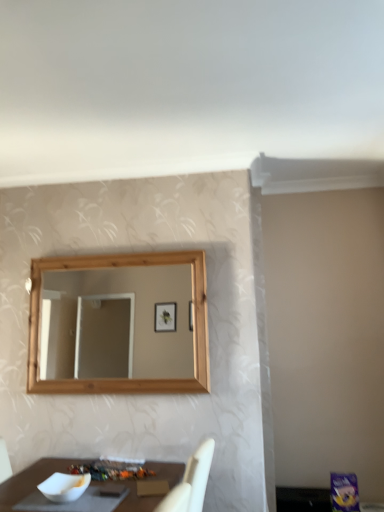
Identify the location of white glossy bowl at lower left. This screenshot has width=384, height=512. (111, 470).

This screenshot has width=384, height=512. What do you see at coordinates (111, 470) in the screenshot?
I see `white glossy bowl at lower left` at bounding box center [111, 470].

This screenshot has height=512, width=384. Identify the location of white matte bowl at lower left. (64, 486).

The height and width of the screenshot is (512, 384). Describe the element at coordinates (64, 486) in the screenshot. I see `white matte bowl at lower left` at that location.

I want to click on white glossy bowl at lower left, so click(111, 470).

Does white matte bowl at lower left appear on the right side of white glossy bowl at lower left?

No, white matte bowl at lower left is not to the right of white glossy bowl at lower left.

Considering the positions of objects white matte bowl at lower left and white glossy bowl at lower left in the image provided, who is behind, white matte bowl at lower left or white glossy bowl at lower left?

Positioned behind is white glossy bowl at lower left.

Between point (86, 488) and point (139, 472), which one is positioned in front?

The point (86, 488) is closer to the camera.

From the image's perspective, is white matte bowl at lower left located above or below white glossy bowl at lower left?

Clearly, from the image's perspective, white matte bowl at lower left is above white glossy bowl at lower left.

From a real-world perspective, which is physically above, white matte bowl at lower left or white glossy bowl at lower left?

white matte bowl at lower left is physically above.

Considering the sizes of objects white matte bowl at lower left and white glossy bowl at lower left in the image provided, who is wider, white matte bowl at lower left or white glossy bowl at lower left?

With larger width is white glossy bowl at lower left.

Can you confirm if white matte bowl at lower left is taller than white glossy bowl at lower left?

Yes, white matte bowl at lower left is taller than white glossy bowl at lower left.

Considering the relative sizes of white matte bowl at lower left and white glossy bowl at lower left in the image provided, is white matte bowl at lower left bigger than white glossy bowl at lower left?

Indeed, white matte bowl at lower left has a larger size compared to white glossy bowl at lower left.

Is white matte bowl at lower left outside of white glossy bowl at lower left?

Yes, white matte bowl at lower left is outside of white glossy bowl at lower left.

Is white matte bowl at lower left not near white glossy bowl at lower left?

That's not correct — white matte bowl at lower left is a little close to white glossy bowl at lower left.

Is white glossy bowl at lower left at the back of white matte bowl at lower left?

Yes, white matte bowl at lower left is facing away from white glossy bowl at lower left.

In the image, there is a white matte bowl at lower left. At what (x,y) coordinates should I click in order to perform the action: click on food below it (from the image's perspective). Please return your answer as a coordinate pair (x, y). This screenshot has width=384, height=512. Looking at the image, I should click on (111, 470).

Considering the relative positions of white glossy bowl at lower left and white matte bowl at lower left in the image provided, is white glossy bowl at lower left to the left or to the right of white matte bowl at lower left?

Clearly, white glossy bowl at lower left is on the right of white matte bowl at lower left in the image.

Is the depth of white glossy bowl at lower left less than that of white matte bowl at lower left?

No, the depth of white glossy bowl at lower left is greater than that of white matte bowl at lower left.

Is point (122, 478) positioned in front of point (48, 480)?

No, it is behind (48, 480).

From the image's perspective, is white glossy bowl at lower left above white matte bowl at lower left?

Incorrect, from the image's perspective, white glossy bowl at lower left is lower than white matte bowl at lower left.

Looking at this image, from a real-world perspective, is white glossy bowl at lower left physically below white matte bowl at lower left?

Yes, from a real-world perspective, white glossy bowl at lower left is below white matte bowl at lower left.

Which object is wider, white glossy bowl at lower left or white matte bowl at lower left?

With larger width is white glossy bowl at lower left.

In the scene shown: Between white glossy bowl at lower left and white matte bowl at lower left, which one has more height?

white matte bowl at lower left.

In terms of size, does white glossy bowl at lower left appear bigger or smaller than white matte bowl at lower left?

In the image, white glossy bowl at lower left appears to be smaller than white matte bowl at lower left.

Which is correct: white glossy bowl at lower left is inside white matte bowl at lower left, or outside of it?

white glossy bowl at lower left cannot be found inside white matte bowl at lower left.

Is white glossy bowl at lower left directly adjacent to white matte bowl at lower left?

They are not placed beside each other.

Is white glossy bowl at lower left aimed at white matte bowl at lower left?

Yes, white glossy bowl at lower left faces towards white matte bowl at lower left.

The height and width of the screenshot is (512, 384). Find the location of `bowl that is above the white glossy bowl at lower left (from the image's perspective)`. bowl that is above the white glossy bowl at lower left (from the image's perspective) is located at coordinates (64, 486).

I want to click on bowl that is above the white glossy bowl at lower left (from the image's perspective), so click(x=64, y=486).

Locate an element on the screen. The height and width of the screenshot is (512, 384). bowl in front of the white glossy bowl at lower left is located at coordinates (64, 486).